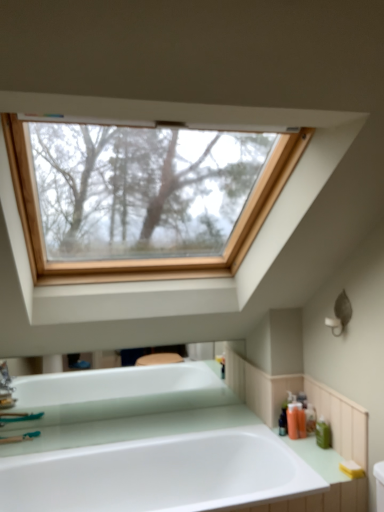
Question: From a real-world perspective, is translucent plastic soap dispenser at right, marked as the 3th toiletry in a front-to-back arrangement, positioned above or below white glossy bathtub at center?

Choices:
 (A) below
 (B) above

Answer: (B)

Question: In terms of height, does translucent plastic soap dispenser at right, marked as the 3th toiletry in a front-to-back arrangement, look taller or shorter compared to white glossy bathtub at center?

Choices:
 (A) short
 (B) tall

Answer: (A)

Question: Which of these objects is positioned closest to the translucent plastic soap dispenser at right, placed as the second toiletry when sorted from back to front?

Choices:
 (A) white glossy bathtub at center
 (B) orange matte bottle at lower right, which is the third toiletry in back-to-front order
 (C) green matte bottle at right, the 4th toiletry in the back-to-front sequence
 (D) translucent plastic soap dispenser at right, placed as the 4th toiletry when sorted from front to back
 (E) yellow sponge at lower right

Answer: (B)

Question: Considering the real-world distances, which object is closest to the translucent plastic soap dispenser at right, which is counted as the 1th toiletry, starting from the back?

Choices:
 (A) translucent plastic soap dispenser at right, placed as the second toiletry when sorted from back to front
 (B) orange matte bottle at lower right, which is the 2th toiletry from front to back
 (C) green matte bottle at right, the 4th toiletry in the back-to-front sequence
 (D) yellow sponge at lower right
 (E) white glossy bathtub at center

Answer: (A)